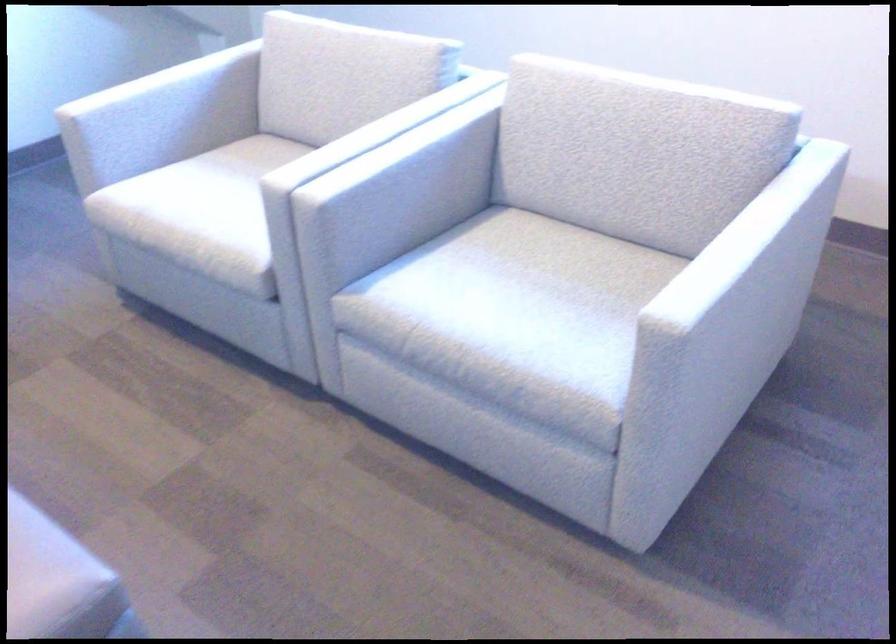
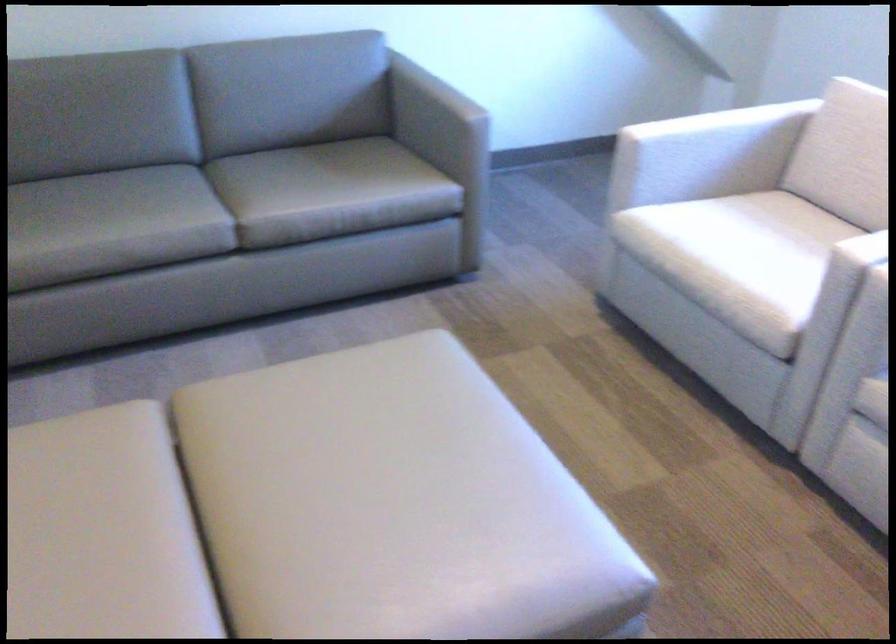
Locate, in the second image, the point that corresponds to [159,77] in the first image.

(719, 120)